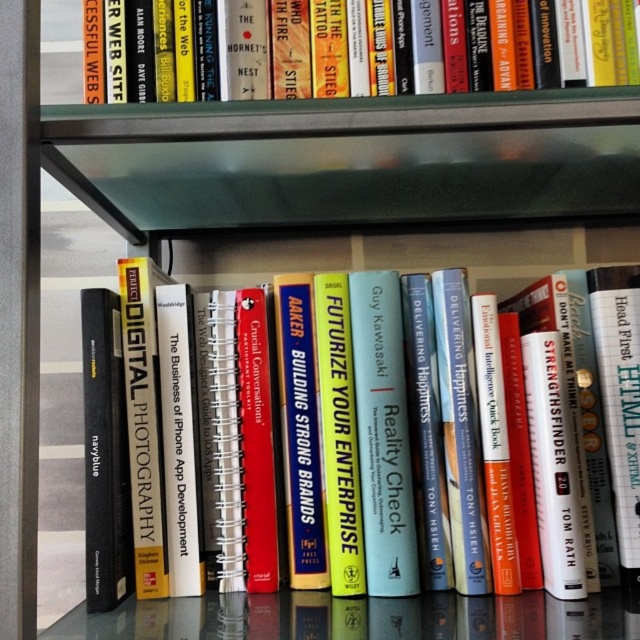
Question: Estimate the real-world distances between objects in this image. Which object is closer to the hardcover book at center?

Choices:
 (A) transparent glass table at lower center
 (B) hardcover book at upper center

Answer: (A)

Question: Based on their relative distances, which object is farther from the hardcover book at center?

Choices:
 (A) hardcover book at upper center
 (B) transparent glass table at lower center

Answer: (A)

Question: Can you confirm if hardcover book at center is positioned to the left of transparent glass table at lower center?

Choices:
 (A) yes
 (B) no

Answer: (B)

Question: Does hardcover book at upper center appear over transparent glass table at lower center?

Choices:
 (A) yes
 (B) no

Answer: (A)

Question: Does hardcover book at upper center have a smaller size compared to transparent glass table at lower center?

Choices:
 (A) no
 (B) yes

Answer: (B)

Question: Which of the following is the farthest from the observer?

Choices:
 (A) hardcover book at upper center
 (B) hardcover book at center

Answer: (B)